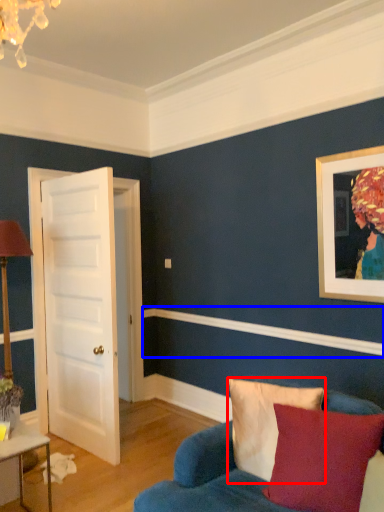
Question: Which point is closer to the camera, pillow (highlighted by a red box) or molding (highlighted by a blue box)?

Choices:
 (A) pillow
 (B) molding

Answer: (A)